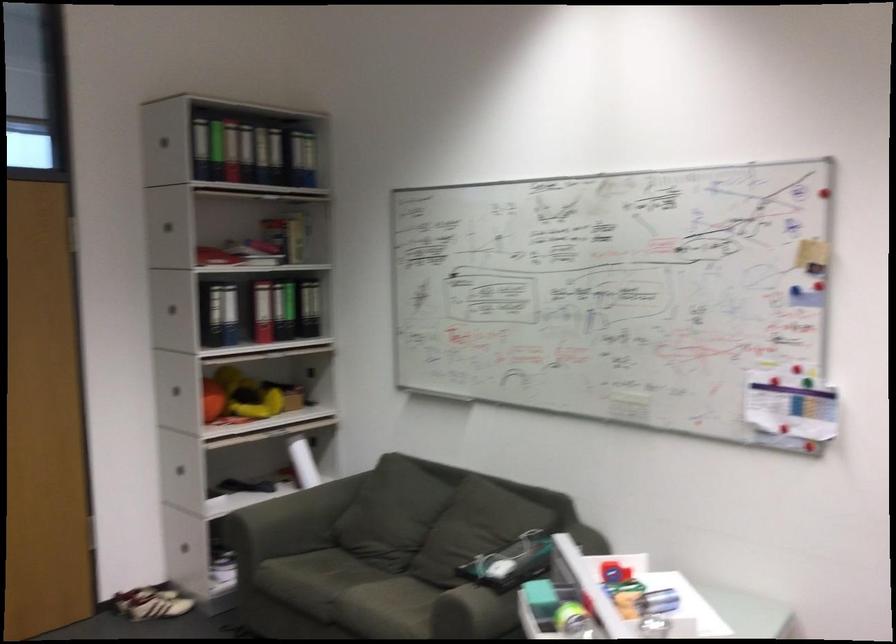
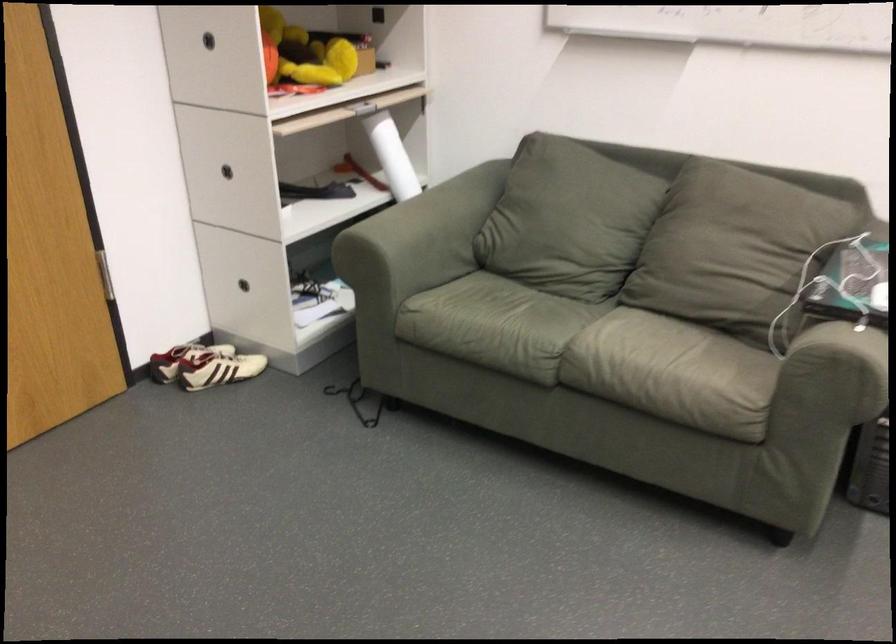
Locate, in the second image, the point that corresponds to [247,402] in the first image.

(303, 53)